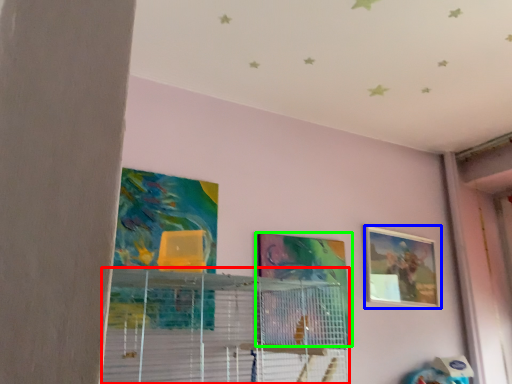
Question: Which object is the closest to the shelf (highlighted by a red box)? Choose among these: picture frame (highlighted by a blue box) or picture frame (highlighted by a green box).

Choices:
 (A) picture frame
 (B) picture frame

Answer: (B)